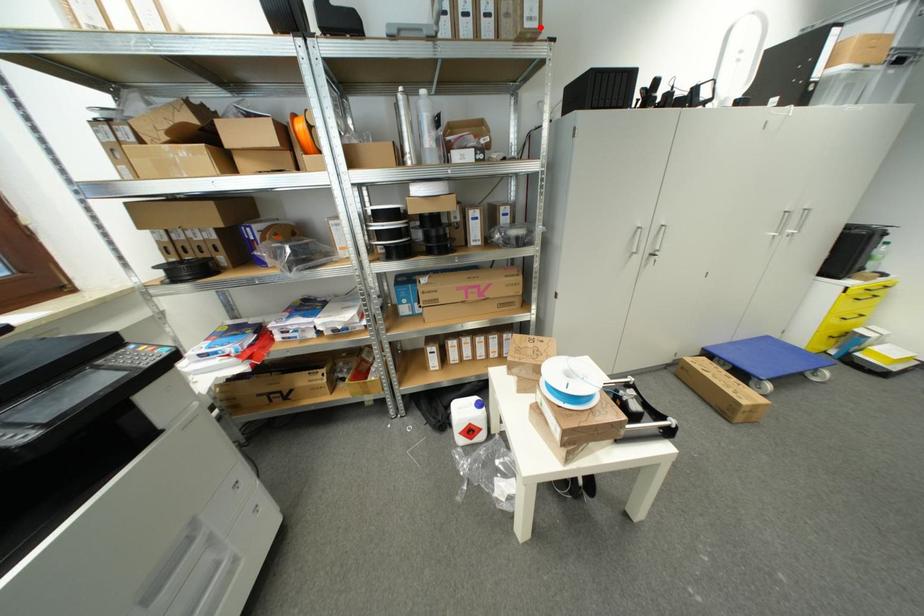
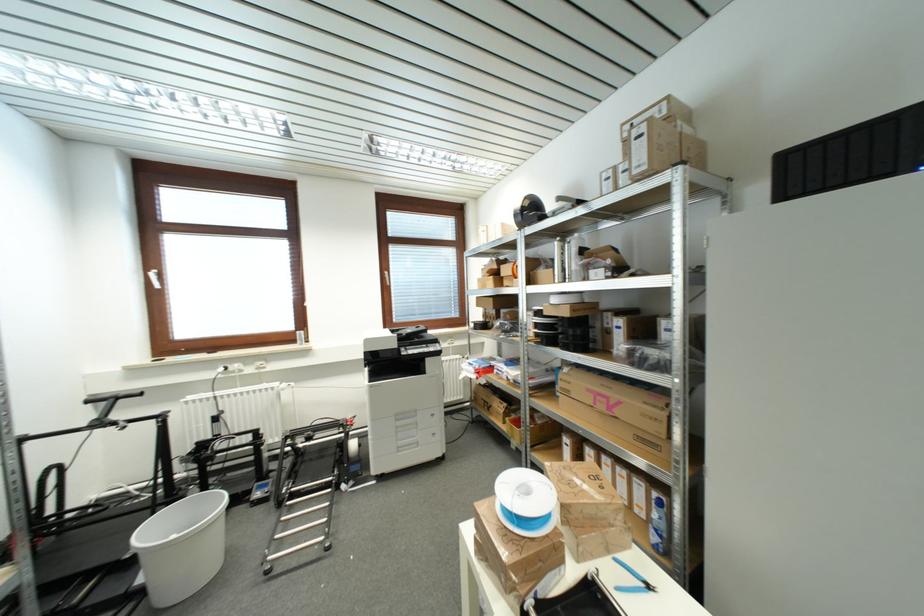
In the second image, find the point that corresponds to the highlighted location in the first image.

(650, 169)